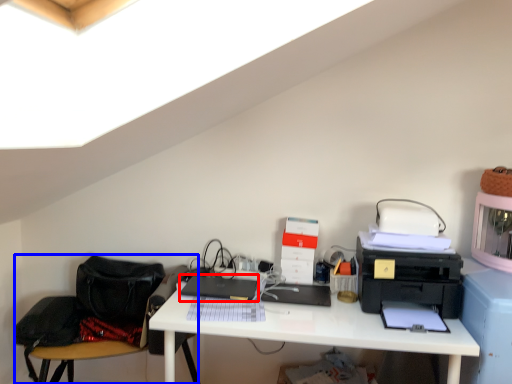
Question: Which object is closer to the camera taking this photo, laptop (highlighted by a red box) or swivel chair (highlighted by a blue box)?

Choices:
 (A) laptop
 (B) swivel chair

Answer: (B)